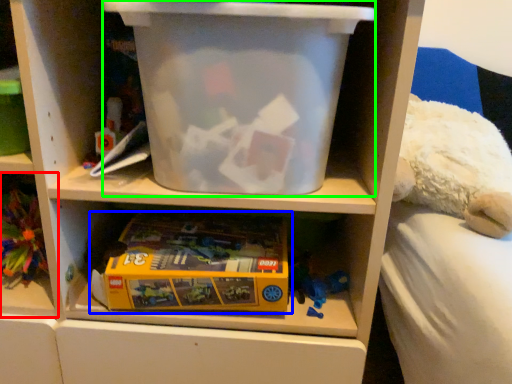
Question: Which object is the closest to the shelf (highlighted by a red box)? Choose among these: toy (highlighted by a blue box) or storage box (highlighted by a green box).

Choices:
 (A) toy
 (B) storage box

Answer: (A)